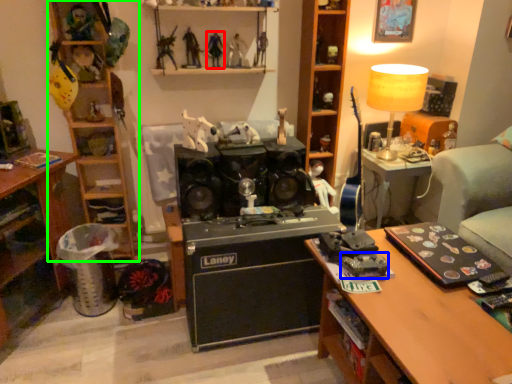
Question: Which object is the farthest from toy (highlighted by a red box)? Choose among these: toy (highlighted by a blue box) or shelf (highlighted by a green box).

Choices:
 (A) toy
 (B) shelf

Answer: (A)